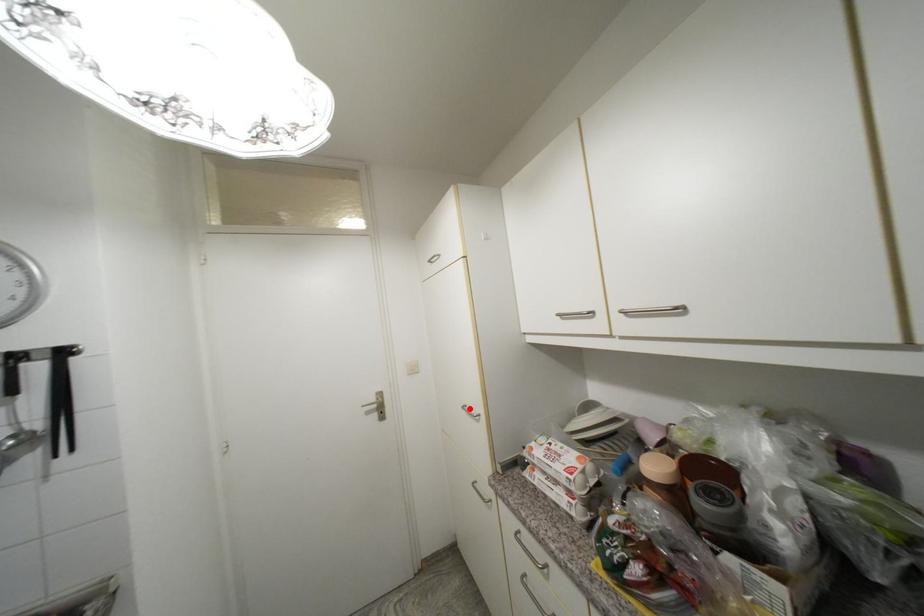
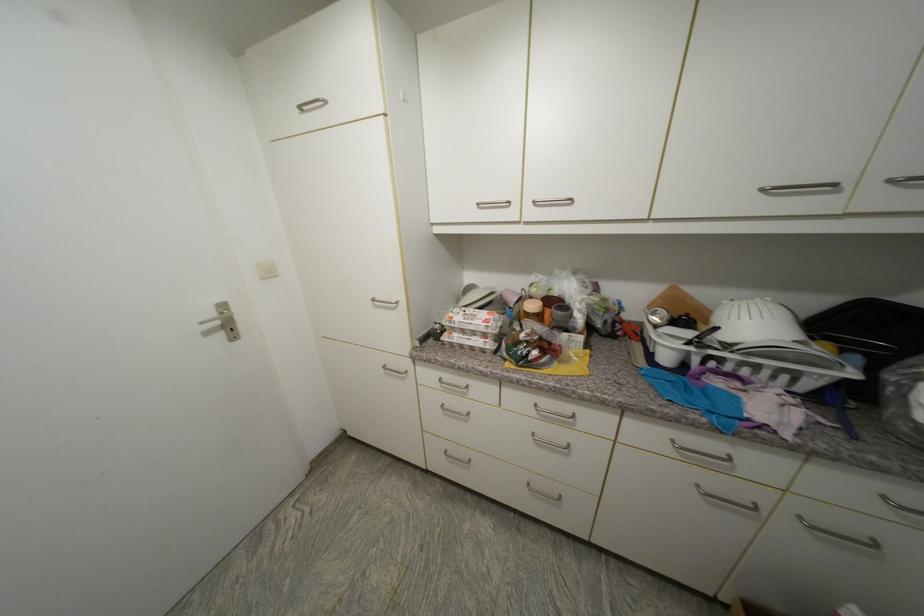
Locate, in the second image, the point that corresponds to the highlighted location in the first image.

(379, 301)